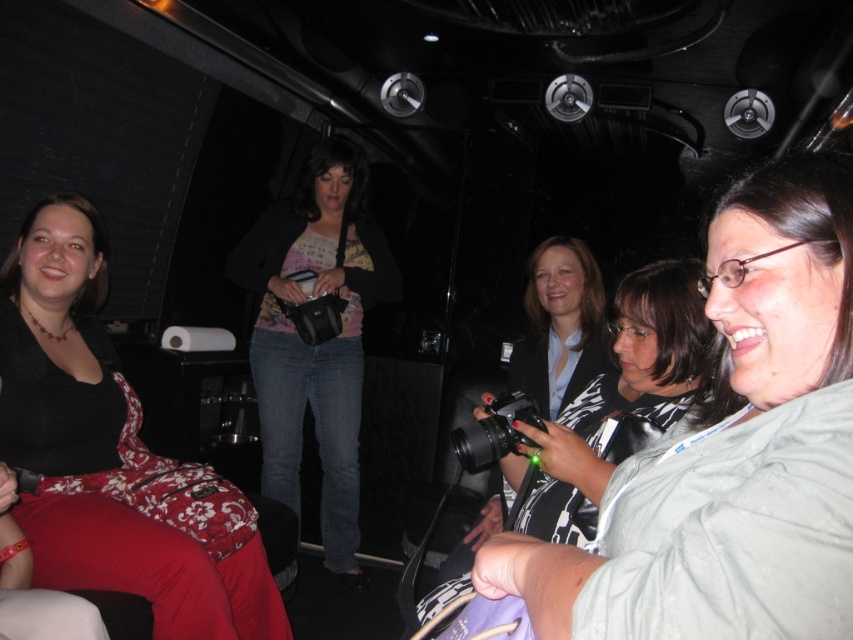
Question: Which point appears closest to the camera in this image?

Choices:
 (A) (804, 385)
 (B) (36, 285)

Answer: (A)

Question: Can you confirm if matte pink shirt at center is positioned to the right of matte black camera at center?

Choices:
 (A) yes
 (B) no

Answer: (B)

Question: Does matte black top at left appear over matte pink shirt at center?

Choices:
 (A) no
 (B) yes

Answer: (A)

Question: Which object is the farthest from the matte pink shirt at center?

Choices:
 (A) matte black top at left
 (B) light gray fabric shirt at center

Answer: (B)

Question: Does matte black top at left appear under matte pink shirt at center?

Choices:
 (A) no
 (B) yes

Answer: (B)

Question: Which point is closer to the camera taking this photo?

Choices:
 (A) (508, 577)
 (B) (270, 586)

Answer: (A)